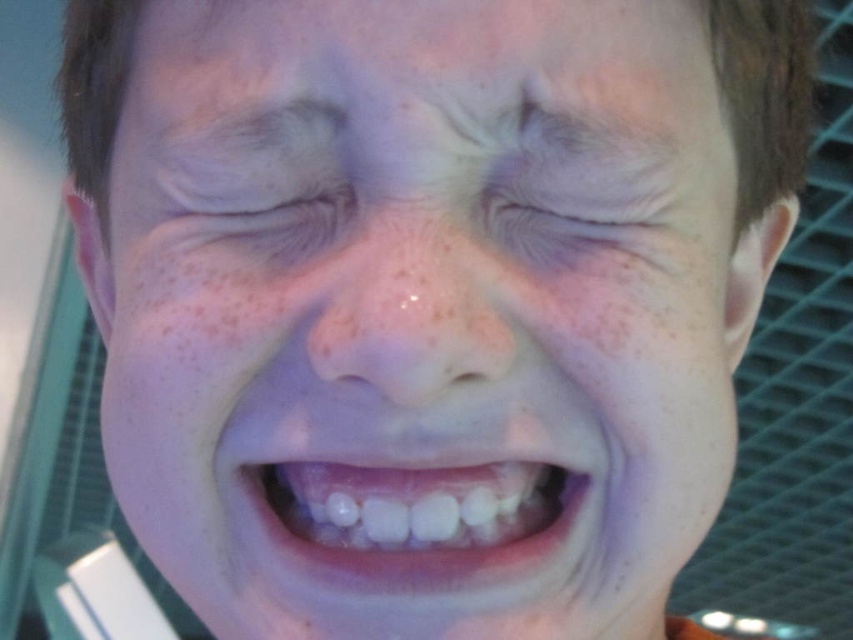
Who is positioned more to the right, white glossy teeth at center or dry skin at center?

dry skin at center is more to the right.

Between point (260, 499) and point (590, 230), which one is positioned behind?

The point (260, 499) is behind.

Find the location of a particular element. The height and width of the screenshot is (640, 853). white glossy teeth at center is located at coordinates (421, 516).

Does point (392, 380) come closer to viewer compared to point (186, 272)?

Yes, point (392, 380) is closer to viewer.

Based on the photo, which is below, pink matte nose at center or brown speckled freckle at upper left?

pink matte nose at center is below.

Is point (444, 339) closer to camera compared to point (247, 328)?

Yes, point (444, 339) is in front of point (247, 328).

The width and height of the screenshot is (853, 640). Identify the location of pink matte nose at center. (405, 312).

Between smooth skin face at center and white glossy teeth at center, which one is positioned higher?

smooth skin face at center

Is smooth skin face at center further to the viewer compared to white glossy teeth at center?

No, it is not.

Between point (711, 348) and point (299, 499), which one is positioned behind?

The point (711, 348) is more distant.

Locate an element on the screen. The height and width of the screenshot is (640, 853). smooth skin face at center is located at coordinates (433, 312).